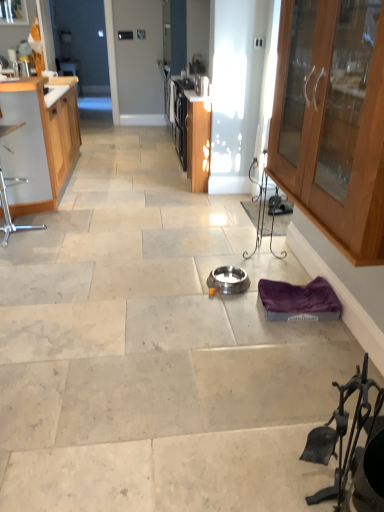
Locate an element on the screen. The width and height of the screenshot is (384, 512). vacant space to the right of satin silver bowl at center, the 1th appliance from the right is located at coordinates (257, 276).